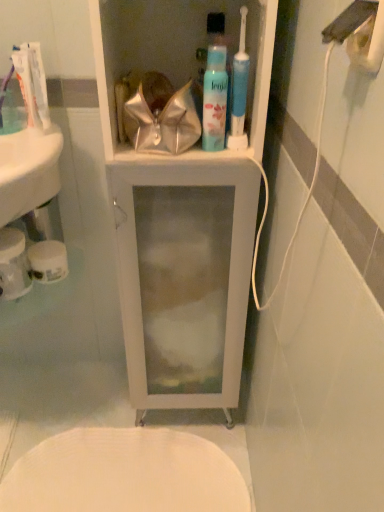
Question: Based on their sizes in the image, would you say translucent plastic mouthwash at upper center is bigger or smaller than white matte toilet paper at lower left, which is the first toilet paper in right-to-left order?

Choices:
 (A) small
 (B) big

Answer: (A)

Question: From a real-world perspective, is translucent plastic mouthwash at upper center physically located above or below white matte toilet paper at lower left, which is the first toilet paper in right-to-left order?

Choices:
 (A) below
 (B) above

Answer: (B)

Question: Which is farther from the white glossy cabinet at center?

Choices:
 (A) translucent plastic toothpaste at upper left, which appears as the 2th toothpaste when viewed from the back
 (B) white matte toilet paper at lower left, placed as the 1th toilet paper when sorted from left to right
 (C) white matte toilet paper at lower left, which appears as the 2th toilet paper when viewed from the left
 (D) white glossy sink at left
 (E) white glossy toothpaste at upper left, placed as the 2th toothpaste when sorted from front to back

Answer: (A)

Question: Which of these objects is positioned closest to the white glossy toothpaste at upper left, which appears as the 1th toothpaste when viewed from the back?

Choices:
 (A) white glossy cabinet at center
 (B) white matte toilet paper at lower left, which appears as the 2th toilet paper when viewed from the left
 (C) translucent plastic mouthwash at upper center
 (D) white textured toilet at lower center
 (E) white glossy sink at left

Answer: (E)